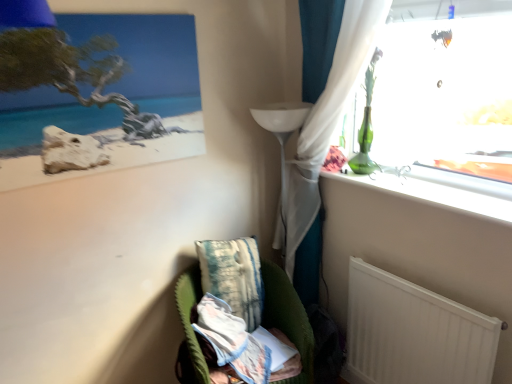
Question: Considering the positions of velvet green armchair at lower center and textured teal pillow at lower center in the image, is velvet green armchair at lower center bigger or smaller than textured teal pillow at lower center?

Choices:
 (A) big
 (B) small

Answer: (A)

Question: Based on their positions, is velvet green armchair at lower center located to the left or right of textured teal pillow at lower center?

Choices:
 (A) left
 (B) right

Answer: (B)

Question: Estimate the real-world distances between objects in this image. Which object is farther from the textured teal pillow at lower center?

Choices:
 (A) matte wooden picture frame at upper left
 (B) white matte radiator at lower right
 (C) velvet green armchair at lower center

Answer: (A)

Question: Estimate the real-world distances between objects in this image. Which object is closer to the matte wooden picture frame at upper left?

Choices:
 (A) textured teal pillow at lower center
 (B) white matte radiator at lower right
 (C) velvet green armchair at lower center

Answer: (A)